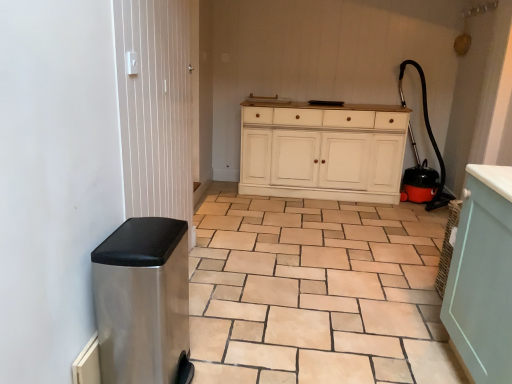
Question: From the image's perspective, does stainless steel trash can at left appear lower than metallic silver screen door at left?

Choices:
 (A) no
 (B) yes

Answer: (B)

Question: From a real-world perspective, does stainless steel trash can at left stand above metallic silver screen door at left?

Choices:
 (A) no
 (B) yes

Answer: (A)

Question: Is stainless steel trash can at left to the right of metallic silver screen door at left from the viewer's perspective?

Choices:
 (A) no
 (B) yes

Answer: (B)

Question: Is stainless steel trash can at left further to camera compared to metallic silver screen door at left?

Choices:
 (A) yes
 (B) no

Answer: (B)

Question: From a real-world perspective, is stainless steel trash can at left under metallic silver screen door at left?

Choices:
 (A) no
 (B) yes

Answer: (B)

Question: From their relative heights in the image, would you say metallic silver screen door at left is taller or shorter than slate gray ceramic tile at lower left?

Choices:
 (A) short
 (B) tall

Answer: (B)

Question: From the image's perspective, is metallic silver screen door at left located above or below slate gray ceramic tile at lower left?

Choices:
 (A) above
 (B) below

Answer: (A)

Question: Considering the relative positions of metallic silver screen door at left and slate gray ceramic tile at lower left in the image provided, is metallic silver screen door at left to the left or to the right of slate gray ceramic tile at lower left?

Choices:
 (A) right
 (B) left

Answer: (B)

Question: Considering the positions of metallic silver screen door at left and slate gray ceramic tile at lower left in the image, is metallic silver screen door at left wider or thinner than slate gray ceramic tile at lower left?

Choices:
 (A) wide
 (B) thin

Answer: (B)

Question: Is metallic silver screen door at left in front of or behind white painted wood cabinet at center in the image?

Choices:
 (A) behind
 (B) front

Answer: (B)

Question: Is metallic silver screen door at left wider or thinner than white painted wood cabinet at center?

Choices:
 (A) wide
 (B) thin

Answer: (B)

Question: Is metallic silver screen door at left to the left or to the right of white painted wood cabinet at center in the image?

Choices:
 (A) right
 (B) left

Answer: (B)

Question: Is metallic silver screen door at left taller or shorter than white painted wood cabinet at center?

Choices:
 (A) tall
 (B) short

Answer: (A)

Question: From a real-world perspective, is white painted wood cabinet at center above or below stainless steel trash can at left?

Choices:
 (A) above
 (B) below

Answer: (A)

Question: Relative to stainless steel trash can at left, is white painted wood cabinet at center in front or behind?

Choices:
 (A) behind
 (B) front

Answer: (A)